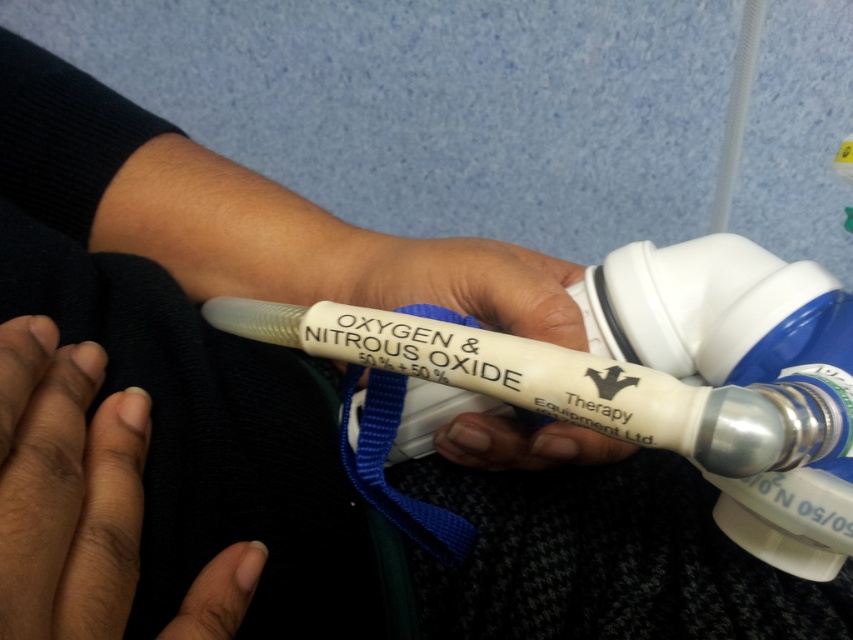
Question: Is dark skin at lower left to the right of white matte oxygen mask at center from the viewer's perspective?

Choices:
 (A) yes
 (B) no

Answer: (B)

Question: Which object is farther from the camera taking this photo?

Choices:
 (A) white matte oxygen mask at center
 (B) dark skin at lower left

Answer: (A)

Question: Does dark skin at lower left appear under white matte oxygen mask at center?

Choices:
 (A) yes
 (B) no

Answer: (A)

Question: Is the position of dark skin at lower left more distant than that of white matte oxygen mask at center?

Choices:
 (A) no
 (B) yes

Answer: (A)

Question: Which object appears closest to the camera in this image?

Choices:
 (A) dark skin at lower left
 (B) white matte oxygen mask at center

Answer: (A)

Question: Which of the following is the closest to the observer?

Choices:
 (A) (503, 268)
 (B) (28, 445)

Answer: (B)